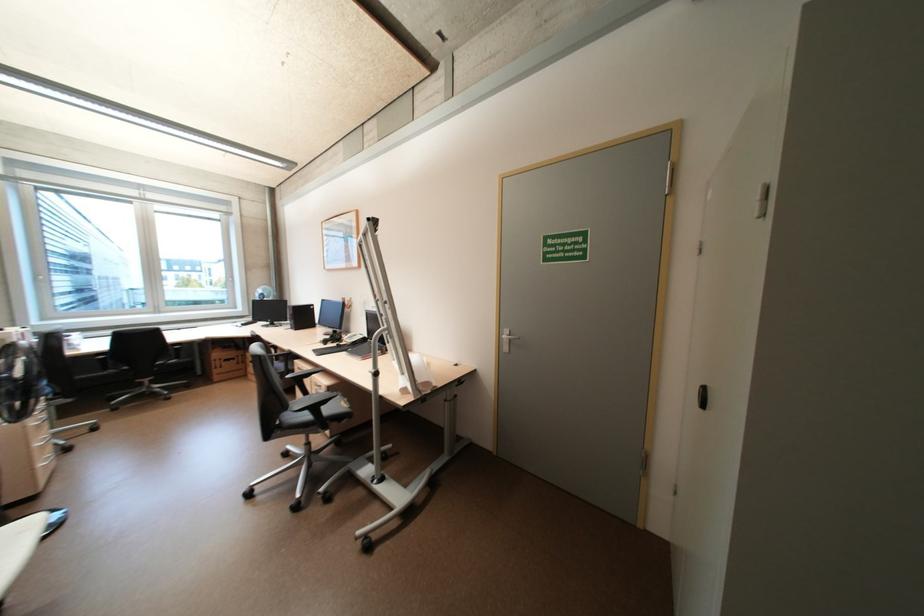
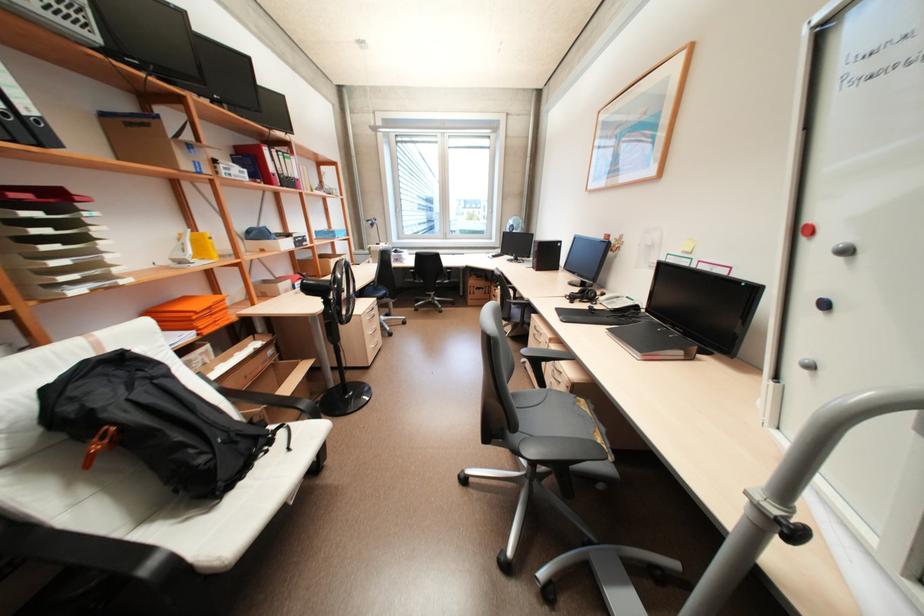
Find the pixel in the second image that matches pixel 345 339 in the first image.

(598, 299)